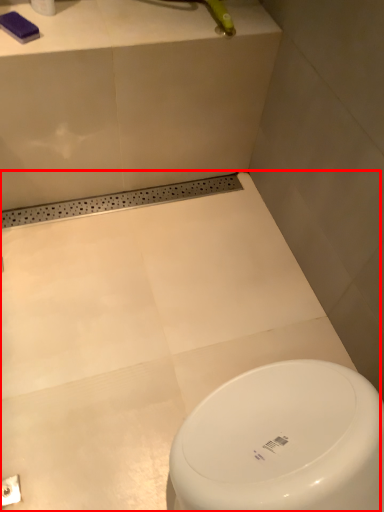
Question: From the image's perspective, what is the correct spatial positioning of bath (annotated by the red box) in reference to toilet paper?

Choices:
 (A) below
 (B) above

Answer: (A)